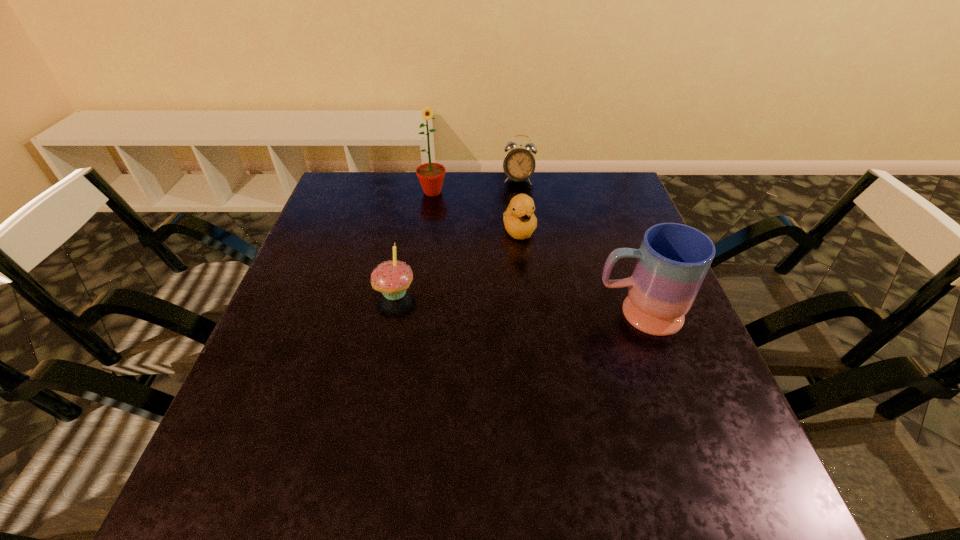
Where is `cupcake`? cupcake is located at coordinates (392, 278).

Image resolution: width=960 pixels, height=540 pixels. Find the location of `mug`. mug is located at coordinates (673, 259).

This screenshot has height=540, width=960. What are the coordinates of `the rightmost object` in the screenshot? It's located at (673, 259).

Locate an element on the screen. The height and width of the screenshot is (540, 960). sunflower is located at coordinates (431, 175).

The height and width of the screenshot is (540, 960). In order to click on the third farthest object in this screenshot , I will do `click(519, 219)`.

You are a GUI agent. You are given a task and a screenshot of the screen. Output one action in this format:
    pyautogui.click(x=<x>, y=<y>)
    Task: Click on the alarm clock
    The height and width of the screenshot is (540, 960).
    Given the screenshot: What is the action you would take?
    pyautogui.click(x=519, y=164)

What are the coordinates of `vacant region located on the left of the cupcake` in the screenshot? It's located at (335, 293).

You are a GUI agent. You are given a task and a screenshot of the screen. Output one action in this format:
    pyautogui.click(x=<x>, y=<y>)
    Task: Click on the free region located on the side of the mug with the handle
    
    Given the screenshot: What is the action you would take?
    pyautogui.click(x=483, y=313)

Identify the location of vacant point located on the side of the mug with the handle. (501, 313).

The image size is (960, 540). Find the location of `blank space located on the side of the mug with the handle`. blank space located on the side of the mug with the handle is located at coordinates (433, 313).